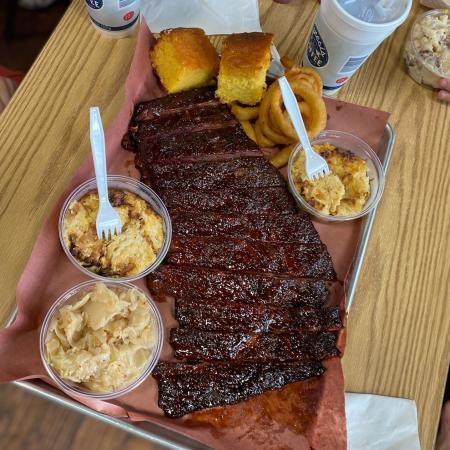
I want to click on clear bowl, so click(x=106, y=394).